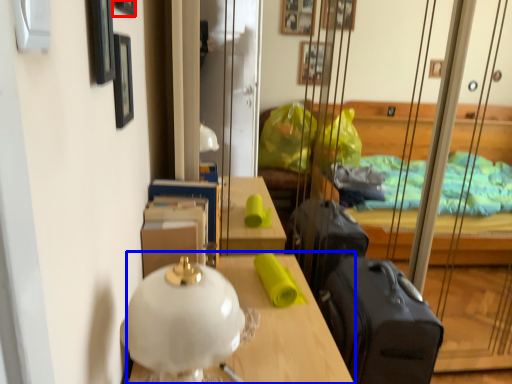
Question: Which point is further to the camera, picture frame (highlighted by a red box) or table (highlighted by a blue box)?

Choices:
 (A) picture frame
 (B) table

Answer: (B)